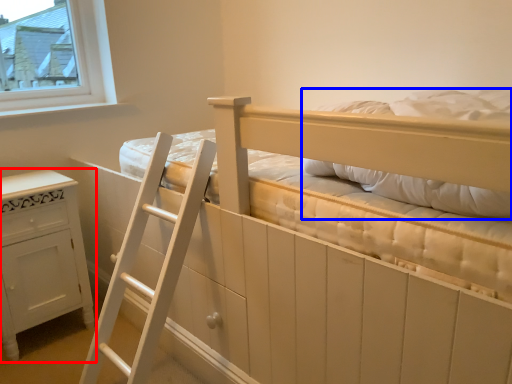
Question: Which object appears farthest to the camera in this image, furniture (highlighted by a red box) or pillow (highlighted by a blue box)?

Choices:
 (A) furniture
 (B) pillow

Answer: (A)